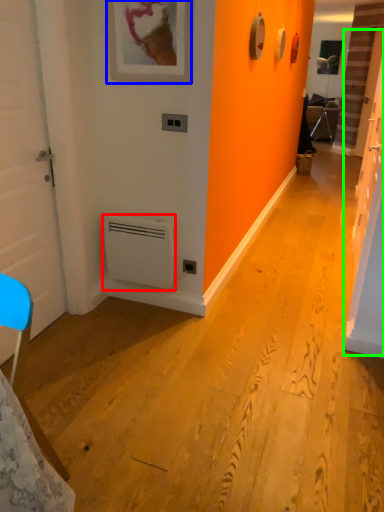
Question: Which object is the closest to the air conditioning (highlighted by a red box)? Choose among these: picture frame (highlighted by a blue box) or door (highlighted by a green box).

Choices:
 (A) picture frame
 (B) door

Answer: (A)